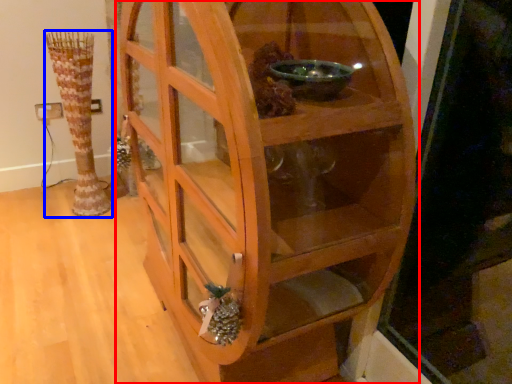
Question: Which object appears closest to the camera in this image, shelf (highlighted by a red box) or vase (highlighted by a blue box)?

Choices:
 (A) shelf
 (B) vase

Answer: (A)